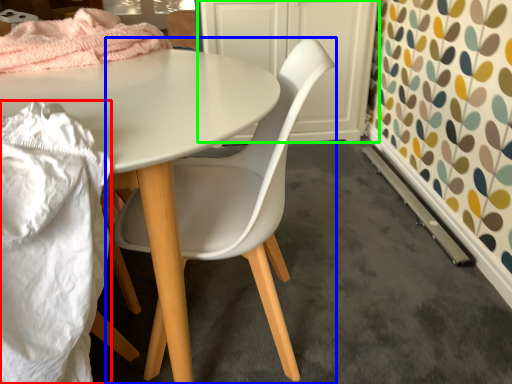
Question: Based on their relative distances, which object is farther from material (highlighted by a red box)? Choose from chair (highlighted by a blue box) and cabinetry (highlighted by a green box).

Choices:
 (A) chair
 (B) cabinetry

Answer: (B)